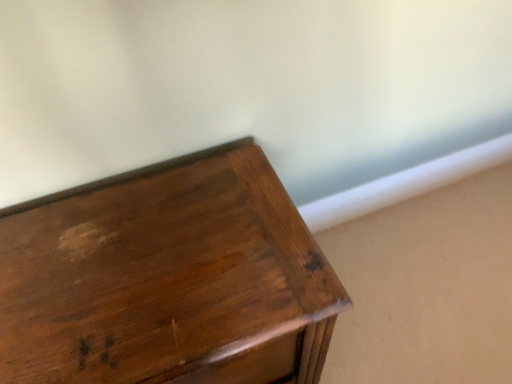
Identify the location of vacant space situated above glossy wood drawer at center (from a real-world perspective). The image size is (512, 384). (138, 257).